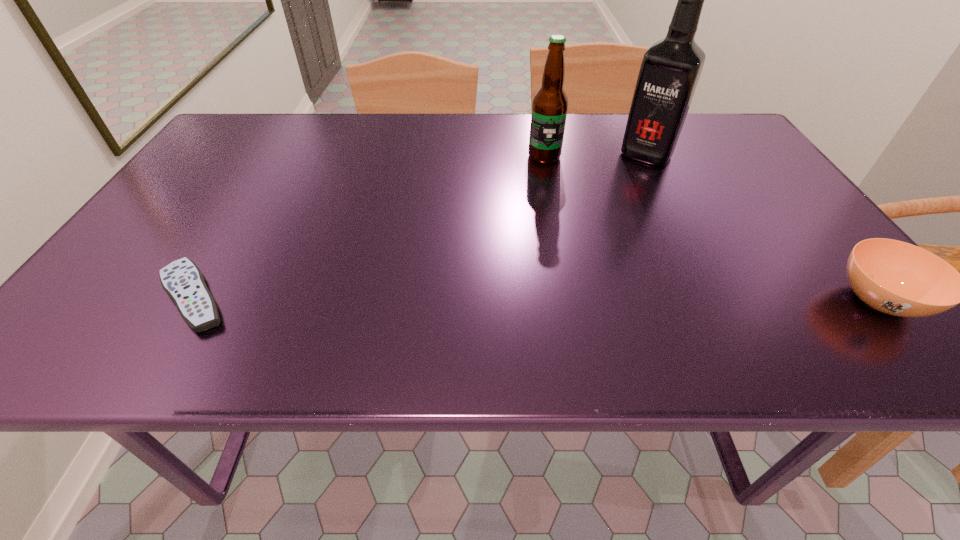
Locate an element on the screen. This screenshot has width=960, height=540. object identified as the closest to the leftmost object is located at coordinates (550, 104).

Where is `object that is the third nearest to the remote control`? The image size is (960, 540). object that is the third nearest to the remote control is located at coordinates (897, 278).

The height and width of the screenshot is (540, 960). Identify the location of free point that satisfies the following two spatial constraints: 1. on the front side of the second object from left to right; 2. on the left side of the soup bowl. (572, 300).